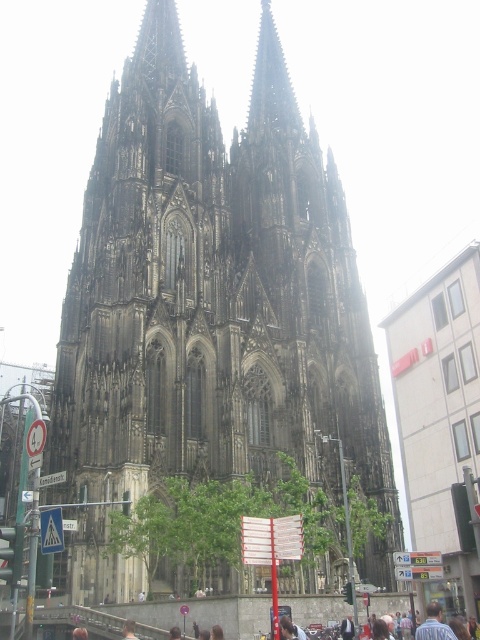
You are a tourist standing on the street in front of the cathedral. You notice the dark stone tower at center and the blonde hair at center. Which object is closer to you?

The blonde hair at center is closer to you because the dark stone tower at center is positioned over it, meaning the tower is behind the hair.

From the picture: You are a tourist visiting the Cologne Cathedral and notice a person wearing a blue shirt at center. If you want to take a photo of the cathedral with the person in the frame, where should you position yourself relative to the person?

The blue shirt at center is located at point [433,625], so you should position yourself slightly to the right and above the person to ensure both the cathedral and the person are in the frame.